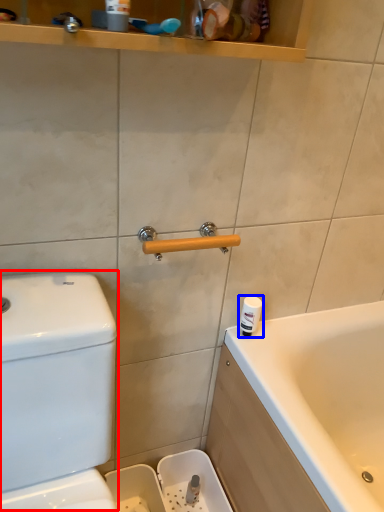
Question: Which point is closer to the camera, water tank (highlighted by a red box) or toiletry (highlighted by a blue box)?

Choices:
 (A) water tank
 (B) toiletry

Answer: (A)